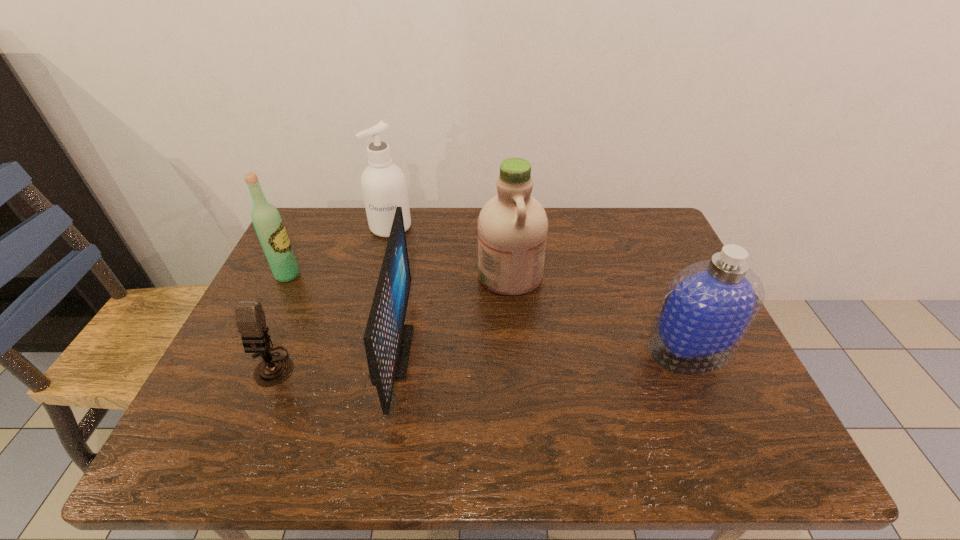
The height and width of the screenshot is (540, 960). I want to click on free point between the second farthest cleansing agent and the computer monitor, so click(451, 313).

Identify the location of free spot between the farthest cleansing agent and the nearest cleansing agent. The image size is (960, 540). (540, 289).

This screenshot has height=540, width=960. In order to click on unoccupied area between the computer monitor and the second cleansing agent from right to left in this screenshot , I will do `click(451, 313)`.

Find the location of a particular element. The image size is (960, 540). empty location between the rightmost object and the computer monitor is located at coordinates (540, 351).

Find the location of `object that is the fourth nearest to the rightmost object`. object that is the fourth nearest to the rightmost object is located at coordinates 250,318.

Find the location of `the closest object relative to the second farthest cleansing agent`. the closest object relative to the second farthest cleansing agent is located at coordinates (387, 340).

Choose which cleansing agent is the second nearest neighbor to the second nearest cleansing agent. Please provide its 2D coordinates. Your answer should be formatted as a tuple, i.e. [(x, y)], where the tuple contains the x and y coordinates of a point satisfying the conditions above.

[(708, 307)]

Select which cleansing agent appears as the second closest to the rightmost cleansing agent. Please provide its 2D coordinates. Your answer should be formatted as a tuple, i.e. [(x, y)], where the tuple contains the x and y coordinates of a point satisfying the conditions above.

[(383, 184)]

At what (x,y) coordinates should I click in order to perform the action: click on free space in the image that satisfies the following two spatial constraints: 1. on the front-facing side of the rightmost object; 2. on the left side of the wine bottle. Please return your answer as a coordinate pair (x, y). The image size is (960, 540). Looking at the image, I should click on (252, 350).